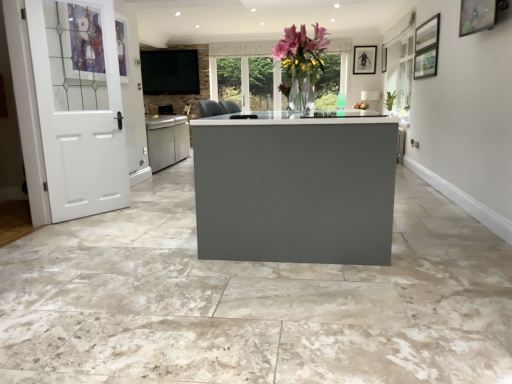
Question: Would you say wooden picture frame at upper right, which is the first picture frame from bottom to top, is outside matte black tv at upper center?

Choices:
 (A) yes
 (B) no

Answer: (A)

Question: Can you confirm if wooden picture frame at upper right, acting as the 2th picture frame starting from the top, is thinner than matte black tv at upper center?

Choices:
 (A) yes
 (B) no

Answer: (A)

Question: From a real-world perspective, does wooden picture frame at upper right, the first picture frame from the front, stand above matte black tv at upper center?

Choices:
 (A) yes
 (B) no

Answer: (A)

Question: Is the depth of wooden picture frame at upper right, placed as the 2th picture frame when sorted from back to front, greater than that of matte black tv at upper center?

Choices:
 (A) yes
 (B) no

Answer: (B)

Question: Is wooden picture frame at upper right, arranged as the 2th picture frame when viewed from the right, at the left side of matte black tv at upper center?

Choices:
 (A) no
 (B) yes

Answer: (A)

Question: Considering the positions of matte black tv at upper center and matte black picture frame at upper right, arranged as the first picture frame when viewed from the right, in the image, is matte black tv at upper center wider or thinner than matte black picture frame at upper right, arranged as the first picture frame when viewed from the right,?

Choices:
 (A) wide
 (B) thin

Answer: (A)

Question: From a real-world perspective, relative to matte black picture frame at upper right, arranged as the first picture frame when viewed from the top, is matte black tv at upper center vertically above or below?

Choices:
 (A) above
 (B) below

Answer: (B)

Question: Visually, is matte black tv at upper center positioned to the left or to the right of matte black picture frame at upper right, which is the second picture frame in bottom-to-top order?

Choices:
 (A) right
 (B) left

Answer: (B)

Question: Is matte black tv at upper center taller or shorter than matte black picture frame at upper right, arranged as the first picture frame when viewed from the top?

Choices:
 (A) tall
 (B) short

Answer: (A)

Question: Is white painted wood door at left inside or outside of matte black picture frame at upper right, placed as the 1th picture frame when sorted from back to front?

Choices:
 (A) inside
 (B) outside

Answer: (B)

Question: From the image's perspective, is white painted wood door at left above or below matte black picture frame at upper right, which is counted as the second picture frame, starting from the front?

Choices:
 (A) below
 (B) above

Answer: (A)

Question: From their relative heights in the image, would you say white painted wood door at left is taller or shorter than matte black picture frame at upper right, arranged as the first picture frame when viewed from the right?

Choices:
 (A) tall
 (B) short

Answer: (A)

Question: Is white painted wood door at left bigger or smaller than matte black picture frame at upper right, arranged as the first picture frame when viewed from the right?

Choices:
 (A) small
 (B) big

Answer: (B)

Question: In terms of width, does wooden picture frame at upper right, the first picture frame from the front, look wider or thinner when compared to matte black tv at upper center?

Choices:
 (A) wide
 (B) thin

Answer: (B)

Question: Based on their sizes in the image, would you say wooden picture frame at upper right, acting as the 2th picture frame starting from the top, is bigger or smaller than matte black tv at upper center?

Choices:
 (A) big
 (B) small

Answer: (B)